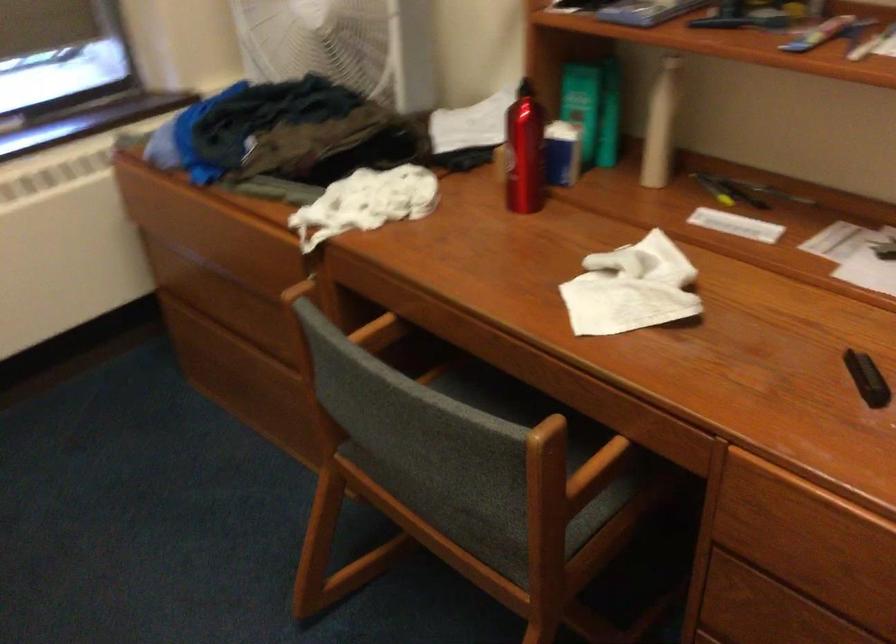
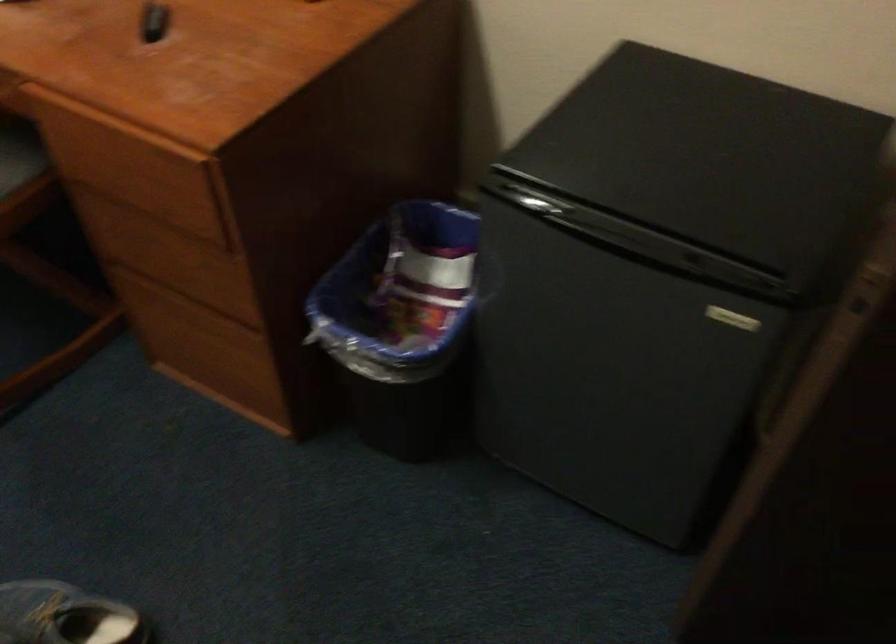
Question: The images are taken continuously from a first-person perspective. In which direction is your viewpoint rotating?

Choices:
 (A) Left
 (B) Right
 (C) Up
 (D) Down

Answer: (B)